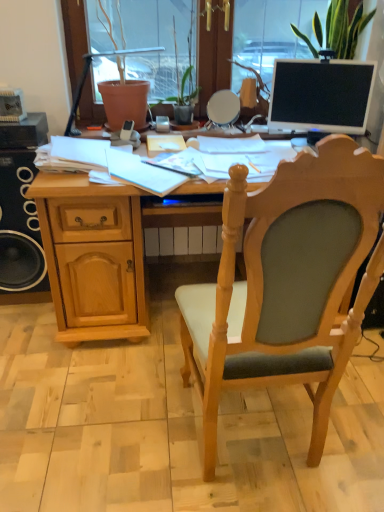
Question: From the image's perspective, relative to black matte speaker at left, is light wood/wooden chair at center above or below?

Choices:
 (A) above
 (B) below

Answer: (B)

Question: Choose the correct answer: Is light wood/wooden chair at center inside black matte speaker at left or outside it?

Choices:
 (A) outside
 (B) inside

Answer: (A)

Question: Based on their relative distances, which object is nearer to the matte black phone at center, which ranks as the first mobile phone in left-to-right order?

Choices:
 (A) light wood/wooden chair at center
 (B) black matte speaker at left
 (C) light wood desk at center
 (D) green textured plant at upper right
 (E) satin silver phone at center, arranged as the first mobile phone when viewed from the back

Answer: (E)

Question: Which object is positioned closest to the black matte speaker at left?

Choices:
 (A) matte black phone at center, the 1th mobile phone from the front
 (B) light wood/wooden chair at center
 (C) light wood desk at center
 (D) satin silver phone at center, acting as the 2th mobile phone starting from the left
 (E) matte black monitor at upper right

Answer: (C)